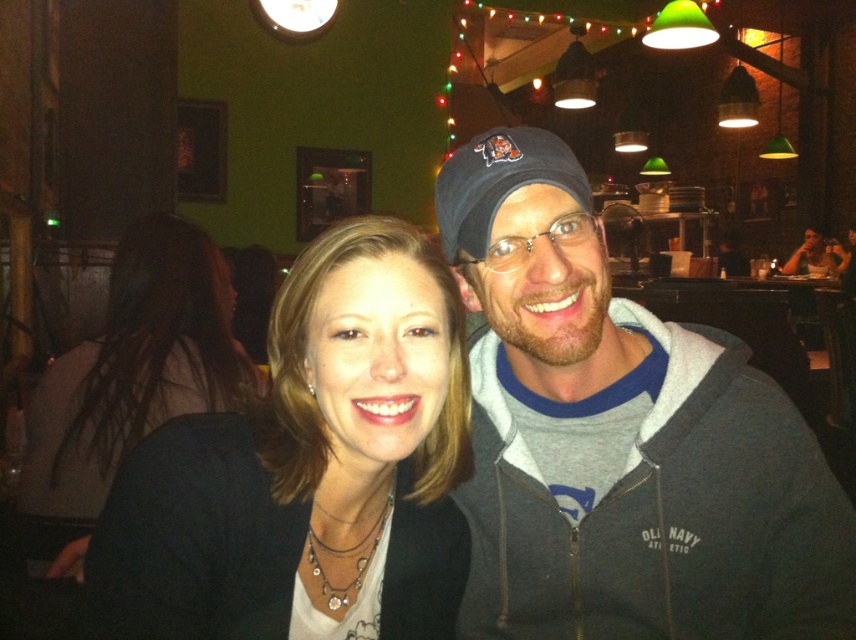
Between gray fleece jacket at center and matte gray hoodie at center, which one is positioned higher?

matte gray hoodie at center is above.

Is point (520, 592) farther from viewer compared to point (816, 244)?

No, it is in front of (816, 244).

The height and width of the screenshot is (640, 856). What are the coordinates of `gray fleece jacket at center` in the screenshot? It's located at (621, 438).

Where is `gray fleece jacket at center`? gray fleece jacket at center is located at coordinates (621, 438).

From the picture: Can you confirm if matte black jacket at center is positioned to the right of matte gray hoodie at center?

Incorrect, matte black jacket at center is not on the right side of matte gray hoodie at center.

Between matte black jacket at center and matte gray hoodie at center, which one has more height?

matte gray hoodie at center

The image size is (856, 640). Describe the element at coordinates (305, 467) in the screenshot. I see `matte black jacket at center` at that location.

This screenshot has width=856, height=640. Find the location of `matte black jacket at center`. matte black jacket at center is located at coordinates (305, 467).

Who is higher up, matte black jacket at center or matte black shirt at center?

matte black jacket at center is higher up.

Is point (367, 563) farther from camera compared to point (198, 276)?

No, (367, 563) is in front of (198, 276).

This screenshot has width=856, height=640. I want to click on matte black jacket at center, so click(x=305, y=467).